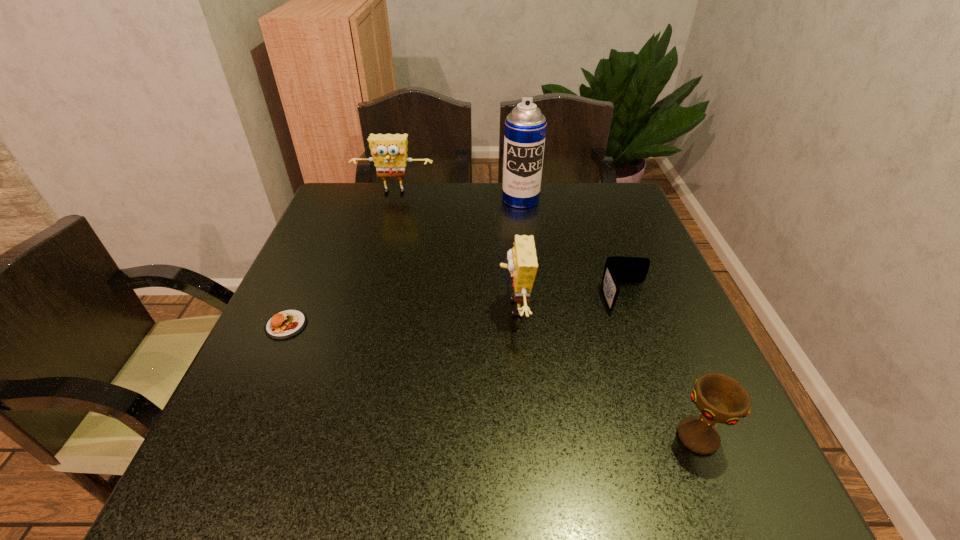
Find the location of a particular element. The image size is (960, 540). chalice that is at the right edge is located at coordinates (721, 399).

Where is `wallet that is at the right edge`? The image size is (960, 540). wallet that is at the right edge is located at coordinates (618, 269).

Where is `object at the far left corner`? This screenshot has width=960, height=540. object at the far left corner is located at coordinates (389, 151).

The height and width of the screenshot is (540, 960). Identify the location of object that is at the near right corner. (721, 399).

The image size is (960, 540). I want to click on vacant space at the far edge of the desktop, so [508, 208].

You are a GUI agent. You are given a task and a screenshot of the screen. Output one action in this format:
    pyautogui.click(x=<x>, y=<y>)
    Task: Click on the vacant space at the near edge
    Image resolution: width=960 pixels, height=540 pixels.
    Given the screenshot: What is the action you would take?
    pyautogui.click(x=320, y=462)

In the image, there is a desktop. Where is `free space at the left edge`? The width and height of the screenshot is (960, 540). free space at the left edge is located at coordinates (247, 429).

Where is `vacant space at the right edge of the desktop`? vacant space at the right edge of the desktop is located at coordinates (664, 454).

Where is `vacant area at the far left corner`? Image resolution: width=960 pixels, height=540 pixels. vacant area at the far left corner is located at coordinates (324, 216).

Locate an element on the screen. vacant space at the near left corner of the desktop is located at coordinates (273, 507).